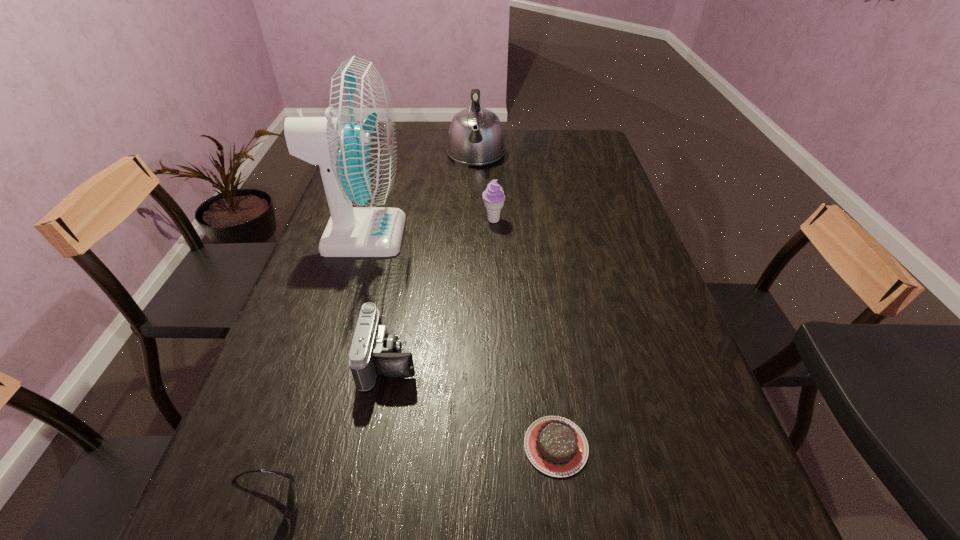
At what (x,y) coordinates should I click in order to perform the action: click on free space located 0.310m at the front of the fourth farthest object with an open lens cover. Please return your answer as a coordinate pair (x, y). The image size is (960, 540). Looking at the image, I should click on (563, 360).

Where is `vacant space located 0.360m on the back of the shortest object`? This screenshot has height=540, width=960. vacant space located 0.360m on the back of the shortest object is located at coordinates (535, 286).

Find the location of a particular element. The image size is (960, 540). object positioned at the far edge is located at coordinates (475, 137).

Identify the location of object at the left edge. (355, 145).

In the image, there is a desktop. At what (x,y) coordinates should I click in order to perform the action: click on blank space at the far edge. Please return your answer as a coordinate pair (x, y). Looking at the image, I should click on (544, 134).

This screenshot has height=540, width=960. I want to click on free region at the left edge, so click(365, 279).

This screenshot has width=960, height=540. In the image, there is a desktop. What are the coordinates of `vacant area at the right edge` in the screenshot? It's located at (629, 277).

Locate an element on the screen. The height and width of the screenshot is (540, 960). vacant space at the far right corner of the desktop is located at coordinates (561, 141).

Image resolution: width=960 pixels, height=540 pixels. Identify the location of free space between the icecream and the chocolate cake. (524, 333).

Where is `vacant point located between the tallest object and the farthest object`? The height and width of the screenshot is (540, 960). vacant point located between the tallest object and the farthest object is located at coordinates pos(420,195).